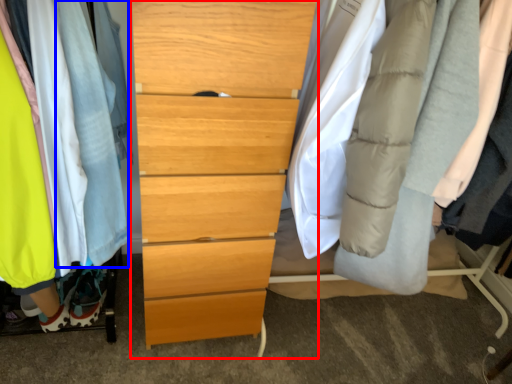
Question: Which object appears farthest to the camera in this image, chest of drawers (highlighted by a red box) or robe (highlighted by a blue box)?

Choices:
 (A) chest of drawers
 (B) robe

Answer: (A)